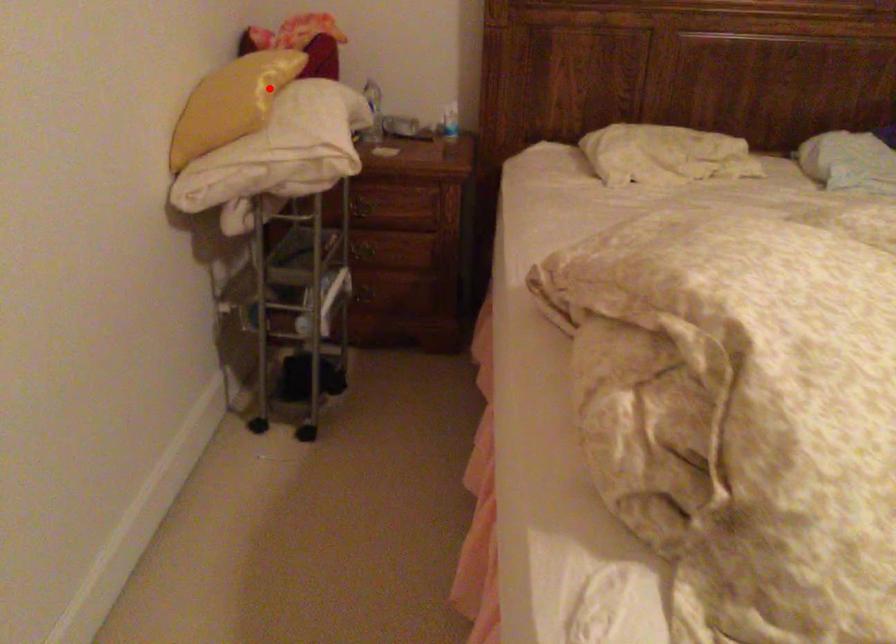
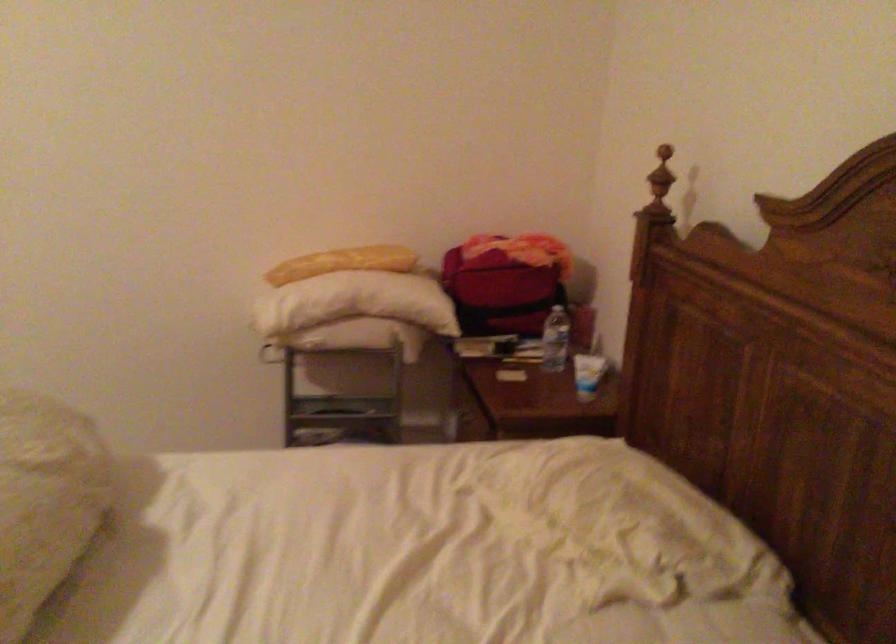
Where in the second image is the point corresponding to the highlighted location from the first image?

(342, 263)